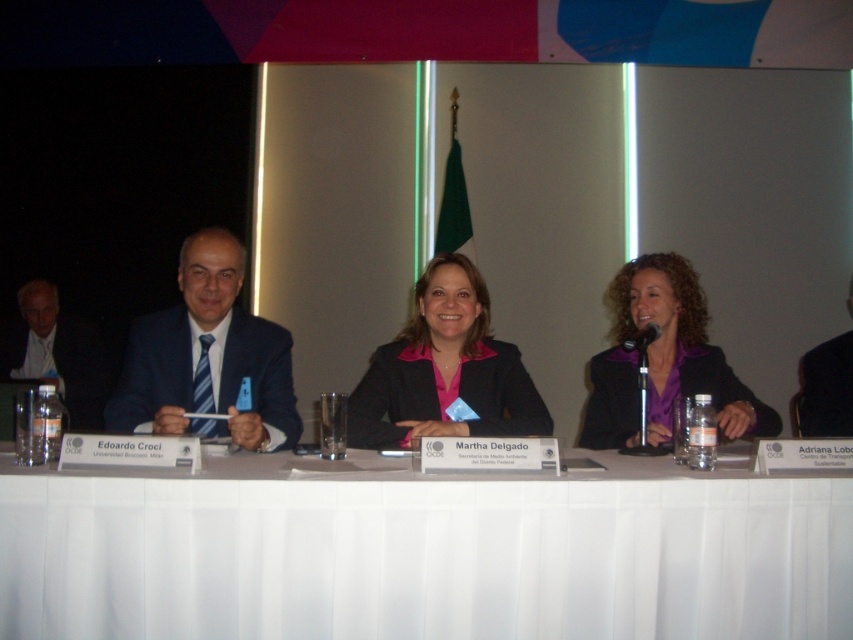
You are sitting at the back of the conference room and want to approach the panelists. Which panelist wearing either the dark blue suit at left or the black fabric suit at right will you reach first?

You will reach the panelist in the dark blue suit at left first because they are closer to you than the black fabric suit at right, which is further away.

From the picture: You are a photographer setting up for a panel discussion. You need to position two lights at the coordinates given. The first light is at point (57,368) and the second at point (822,365). From the perspective of someone facing the stage, which light is closer to the front of the stage?

Point (822,365) is closer to the front of the stage because it is in front of point (57,368), which is behind it.

You are organizing a conference and need to place a 1.5 meter long banner along the length of the white fabric table at center. Given the blue striped tie at left is 10 cm wide, can the banner fit on the table?

The white fabric table at center is wider than the blue striped tie at left, but since the blue striped tie at left is only 10 cm wide, the table is wider than 10 cm. However, the banner is 1.5 meters long, which is 150 cm. The question is about the table length, but the description only compares their widths. Therefore, the provided information is insufficient to determine if the banner can fit along the table length.